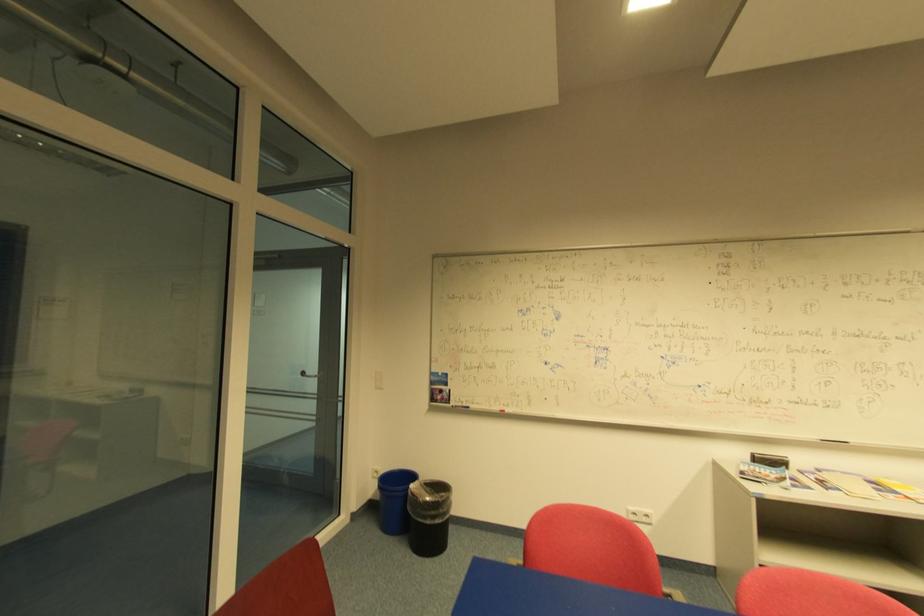
Identify the location of black trash can. The width and height of the screenshot is (924, 616). (429, 516).